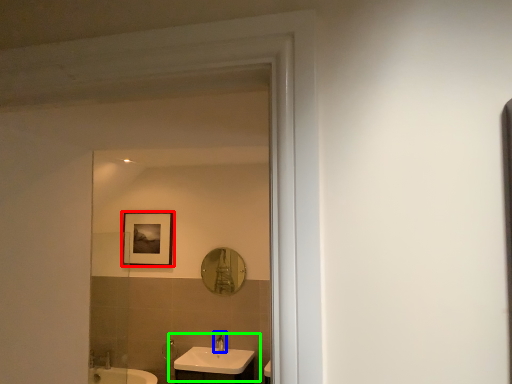
Question: Which is nearer to the picture frame (highlighted by a red box)? tap (highlighted by a blue box) or sink (highlighted by a green box).

Choices:
 (A) tap
 (B) sink

Answer: (B)